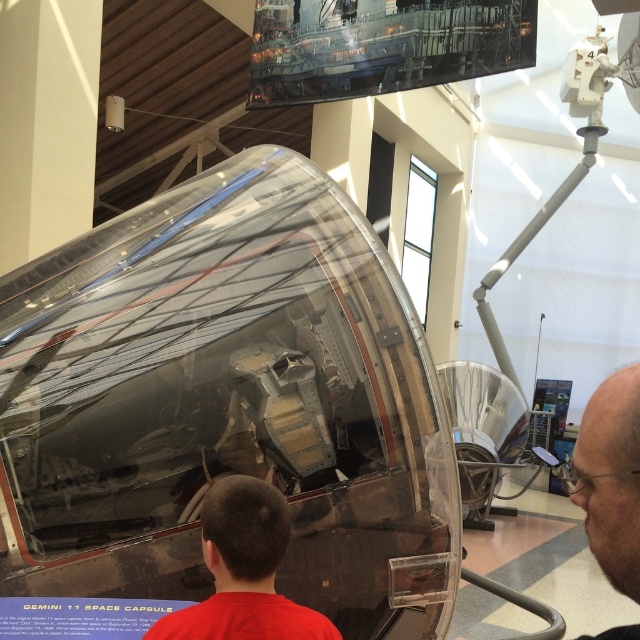
You are an AI tour guide in the museum. A visitor asks if they can see both the red shirt at lower center and the glossy bald head at upper right from their current position. Based on the spatial arrangement, how would you respond?

The red shirt at lower center is closer to you than the glossy bald head at upper right, so you can see both objects from your current position because the red shirt at lower center is not blocking the view of the glossy bald head at upper right.

You are standing in the museum and see two points marked on the Gemini 11 Space Capsule. The first point is at coordinates point (257, 596) and the second point is at point (621, 396). From your perspective, which point is closer to you?

Point (257, 596) is behind point (621, 396), so the point closer to you is point (621, 396).